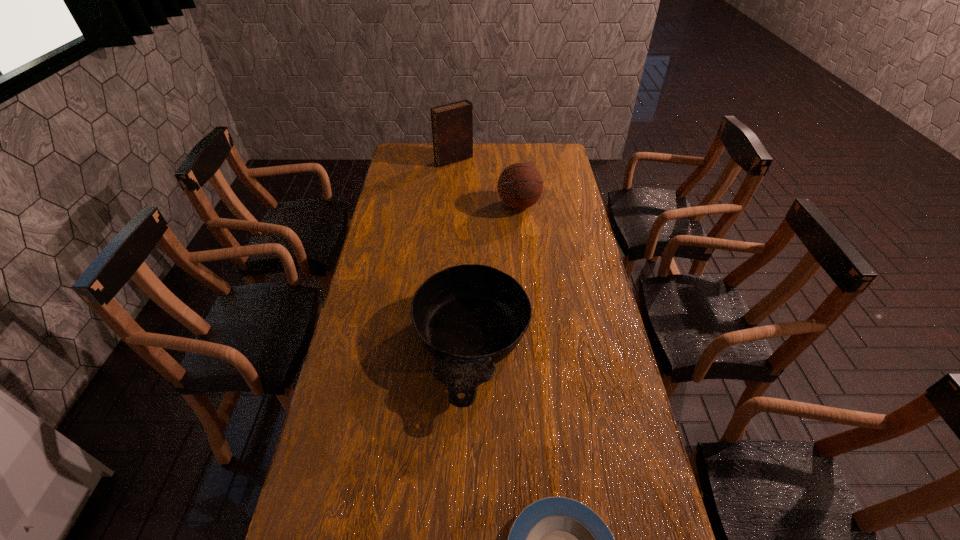
The width and height of the screenshot is (960, 540). I want to click on free spot between the third nearest object and the Bible, so click(487, 182).

Locate which object is the third closest to the second tallest object. Please provide its 2D coordinates. Your answer should be formatted as a tuple, i.e. [(x, y)], where the tuple contains the x and y coordinates of a point satisfying the conditions above.

[(556, 539)]

Image resolution: width=960 pixels, height=540 pixels. Identify the location of object that is the third closest one to the third tallest object. (452, 124).